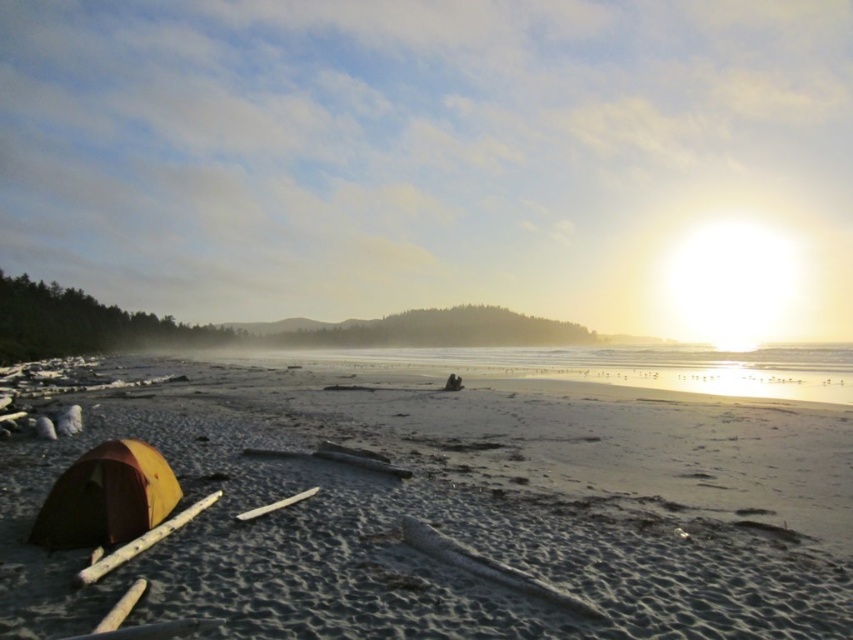
Can you confirm if smooth sand at lower left is shorter than orange fabric tent at lower left?

Yes.

Is smooth sand at lower left bigger than orange fabric tent at lower left?

Yes, smooth sand at lower left is bigger than orange fabric tent at lower left.

Is point (621, 474) closer to camera compared to point (85, 454)?

No, it is not.

Find the location of a particular element. smooth sand at lower left is located at coordinates (457, 506).